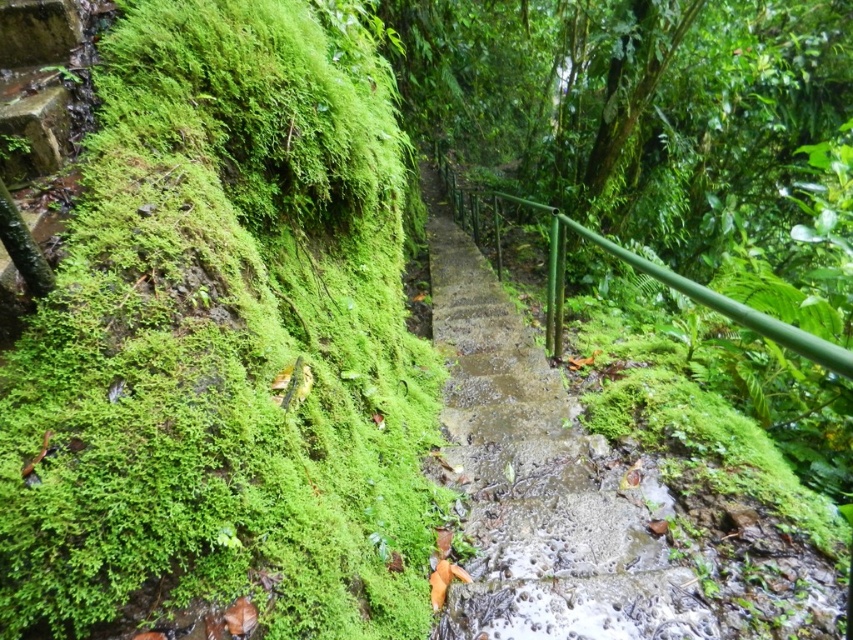
Question: Which point is closer to the camera taking this photo?

Choices:
 (A) (555, 218)
 (B) (645, 490)

Answer: (B)

Question: Does green mossy rock at left appear over green concrete stairs at center?

Choices:
 (A) yes
 (B) no

Answer: (A)

Question: Which point is closer to the camera?

Choices:
 (A) tap(352, 570)
 (B) tap(466, 330)

Answer: (A)

Question: Is green concrete stairs at center closer to the viewer compared to green metal railing at center?

Choices:
 (A) no
 (B) yes

Answer: (A)

Question: Based on their relative distances, which object is nearer to the green mossy rock at left?

Choices:
 (A) green concrete stairs at center
 (B) green metal railing at center

Answer: (A)

Question: Observing the image, what is the correct spatial positioning of green concrete stairs at center in reference to green metal railing at center?

Choices:
 (A) below
 (B) above

Answer: (A)